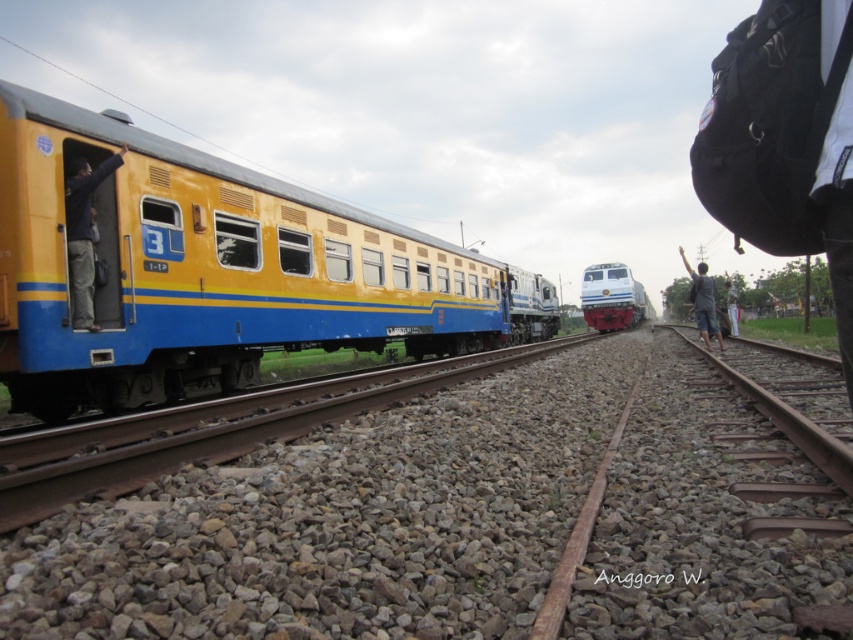
You are a passenger on the yellow and blue train with the number 3. You notice a dark blue fabric jacket at left. Where is the dark blue fabric jacket located relative to the white and red train on the right side of the image?

The dark blue fabric jacket at left is located at point (83, 232), which is to the left of the white and red train on the right side of the image.

You are a railway worker standing on the tracks between the white glossy locomotive at center and the dark gray fabric pants at right. You need to move to a safe area 100 feet away from both objects. Is there enough space between them to move sideways without crossing either object?

The distance between the white glossy locomotive at center and the dark gray fabric pants at right is 68.46 feet. Since you need to be 100 feet away from both, there isn t enough space to move sideways between them without coming too close to at least one object.